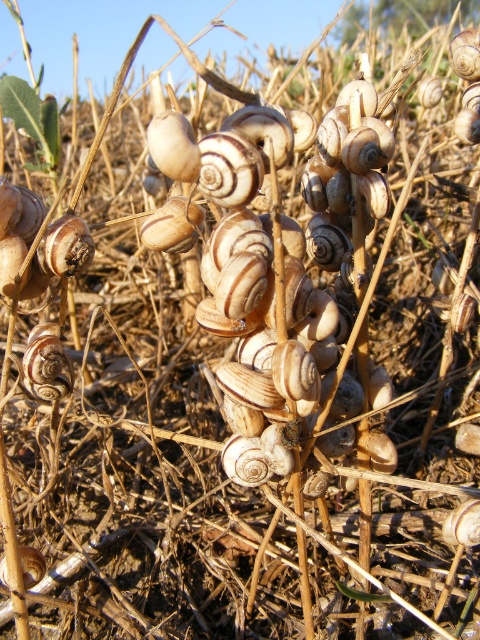
Between matte beige shell at center and matte white shell at center, which one is positioned higher?

matte beige shell at center is higher up.

Is point (193, 164) less distant than point (55, 324)?

Yes, it is.

The image size is (480, 640). What do you see at coordinates (285, 266) in the screenshot?
I see `matte beige shell at center` at bounding box center [285, 266].

I want to click on matte beige shell at center, so click(285, 266).